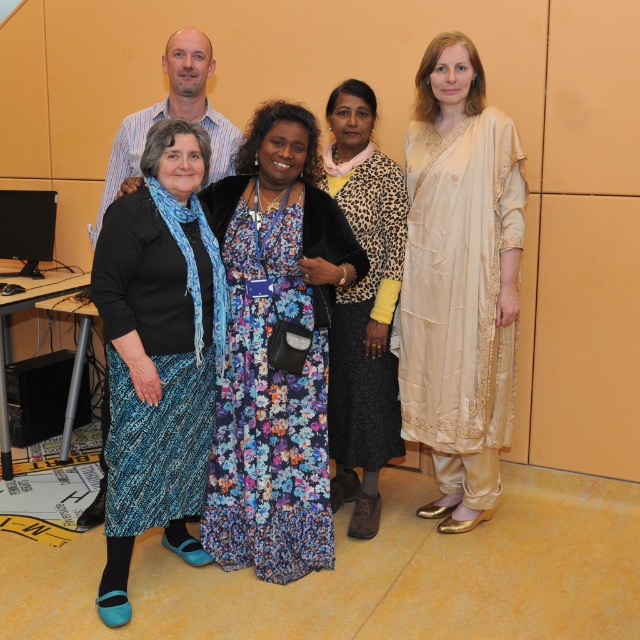
Question: Estimate the real-world distances between objects in this image. Which object is closer to the cream satin kurta at right?

Choices:
 (A) blue textured skirt at lower left
 (B) leopard print jacket at center
 (C) floral dress at center

Answer: (B)

Question: Where is cream satin kurta at right located in relation to leopard print jacket at center in the image?

Choices:
 (A) above
 (B) below

Answer: (A)

Question: In this image, where is cream satin kurta at right located relative to leopard print jacket at center?

Choices:
 (A) left
 (B) right

Answer: (B)

Question: Which point is closer to the camera?

Choices:
 (A) (378, 205)
 (B) (112, 620)

Answer: (B)

Question: Is the position of floral dress at center less distant than that of blue textured skirt at lower left?

Choices:
 (A) no
 (B) yes

Answer: (A)

Question: Based on their relative distances, which object is nearer to the blue textured skirt at lower left?

Choices:
 (A) leopard print jacket at center
 (B) cream satin kurta at right

Answer: (A)